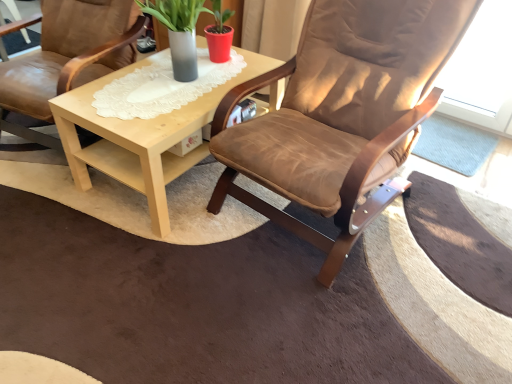
In order to click on brown leather chair at center, marked as the first chair in a left-to-right arrangement in this screenshot , I will do `click(66, 58)`.

I want to click on light wood/texture coffee table at center, so click(141, 137).

This screenshot has width=512, height=384. Find the location of `brown leather chair at center, acting as the second chair starting from the right`. brown leather chair at center, acting as the second chair starting from the right is located at coordinates (66, 58).

Is brown leather chair at center, marked as the first chair in a left-to-right arrangement, at the left side of matte gray vase at center?

Yes, brown leather chair at center, marked as the first chair in a left-to-right arrangement, is to the left of matte gray vase at center.

Which object is closer to the camera, brown leather chair at center, acting as the second chair starting from the right, or matte gray vase at center?

brown leather chair at center, acting as the second chair starting from the right, is more forward.

Is brown leather chair at center, acting as the second chair starting from the right, looking in the opposite direction of matte gray vase at center?

No, brown leather chair at center, acting as the second chair starting from the right, is not facing away from matte gray vase at center.

Is brown leather chair at center, marked as the first chair in a left-to-right arrangement, with matte gray vase at center?

brown leather chair at center, marked as the first chair in a left-to-right arrangement, and matte gray vase at center are clearly separated.

Can you confirm if matte gray vase at center is shorter than brown suede chair at center, which appears as the first chair when viewed from the right?

Yes.

Based on their positions, is matte gray vase at center located to the left or right of brown suede chair at center, the second chair when ordered from left to right?

From the image, it's evident that matte gray vase at center is to the left of brown suede chair at center, the second chair when ordered from left to right.

Could you measure the distance between matte gray vase at center and brown suede chair at center, which appears as the first chair when viewed from the right?

23.62 inches.

Considering the points (180, 38) and (272, 154), which point is behind, point (180, 38) or point (272, 154)?

Positioned behind is point (180, 38).

Which is correct: matte gray vase at center is inside brown leather chair at center, marked as the first chair in a left-to-right arrangement, or outside of it?

matte gray vase at center exists outside the volume of brown leather chair at center, marked as the first chair in a left-to-right arrangement.

From the image's perspective, which is above, matte gray vase at center or brown leather chair at center, marked as the first chair in a left-to-right arrangement?

brown leather chair at center, marked as the first chair in a left-to-right arrangement.

There is a brown leather chair at center, acting as the second chair starting from the right. Where is `houseplant above it (from a real-world perspective)`? Image resolution: width=512 pixels, height=384 pixels. houseplant above it (from a real-world perspective) is located at coordinates (179, 32).

Who is smaller, matte gray vase at center or brown leather chair at center, acting as the second chair starting from the right?

Smaller between the two is matte gray vase at center.

Is brown leather chair at center, marked as the first chair in a left-to-right arrangement, looking in the opposite direction of brown suede chair at center, the second chair when ordered from left to right?

No.

Can you see brown leather chair at center, marked as the first chair in a left-to-right arrangement, touching brown suede chair at center, the second chair when ordered from left to right?

No.

Could brown suede chair at center, which appears as the first chair when viewed from the right, be considered to be inside brown leather chair at center, acting as the second chair starting from the right?

No.

I want to click on chair that is under the brown suede chair at center, the second chair when ordered from left to right (from a real-world perspective), so click(x=66, y=58).

Is light wood/texture coffee table at center outside of brown leather chair at center, marked as the first chair in a left-to-right arrangement?

Yes, light wood/texture coffee table at center is not within brown leather chair at center, marked as the first chair in a left-to-right arrangement.

Could you measure the distance between light wood/texture coffee table at center and brown leather chair at center, acting as the second chair starting from the right?

A distance of 14.78 inches exists between light wood/texture coffee table at center and brown leather chair at center, acting as the second chair starting from the right.

Does light wood/texture coffee table at center lie behind brown leather chair at center, acting as the second chair starting from the right?

Yes.

Locate an element on the screen. Image resolution: width=512 pixels, height=384 pixels. coffee table located below the brown leather chair at center, acting as the second chair starting from the right (from the image's perspective) is located at coordinates (141, 137).

Is light wood/texture coffee table at center shorter than brown suede chair at center, the second chair when ordered from left to right?

Yes, light wood/texture coffee table at center is shorter than brown suede chair at center, the second chair when ordered from left to right.

Could you tell me if light wood/texture coffee table at center is facing brown suede chair at center, which appears as the first chair when viewed from the right?

No.

Is light wood/texture coffee table at center bigger or smaller than brown suede chair at center, the second chair when ordered from left to right?

light wood/texture coffee table at center is smaller than brown suede chair at center, the second chair when ordered from left to right.

In the image, is light wood/texture coffee table at center positioned in front of or behind matte gray vase at center?

Visually, light wood/texture coffee table at center is located in front of matte gray vase at center.

Is light wood/texture coffee table at center looking in the opposite direction of matte gray vase at center?

No, light wood/texture coffee table at center is not facing the opposite direction of matte gray vase at center.

Considering the relative sizes of light wood/texture coffee table at center and matte gray vase at center in the image provided, is light wood/texture coffee table at center shorter than matte gray vase at center?

Incorrect, the height of light wood/texture coffee table at center does not fall short of that of matte gray vase at center.

Where is `the 1st chair in front of the matte gray vase at center`? the 1st chair in front of the matte gray vase at center is located at coordinates (66, 58).

Identify the location of chair that is the 1st one below the matte gray vase at center (from a real-world perspective). (340, 113).

Based on the photo, considering their positions, is light wood/texture coffee table at center positioned closer to brown suede chair at center, the second chair when ordered from left to right, than brown leather chair at center, acting as the second chair starting from the right?

light wood/texture coffee table at center.

Estimate the real-world distances between objects in this image. Which object is further from matte gray vase at center, light wood/texture coffee table at center or brown suede chair at center, which appears as the first chair when viewed from the right?

brown suede chair at center, which appears as the first chair when viewed from the right, lies further to matte gray vase at center than the other object.

Estimate the real-world distances between objects in this image. Which object is closer to light wood/texture coffee table at center, brown leather chair at center, acting as the second chair starting from the right, or matte gray vase at center?

Among the two, matte gray vase at center is located nearer to light wood/texture coffee table at center.

Considering their positions, is brown suede chair at center, which appears as the first chair when viewed from the right, positioned closer to light wood/texture coffee table at center than brown leather chair at center, marked as the first chair in a left-to-right arrangement?

The object closer to light wood/texture coffee table at center is brown leather chair at center, marked as the first chair in a left-to-right arrangement.

From the image, which object appears to be farther from light wood/texture coffee table at center, matte gray vase at center or brown leather chair at center, acting as the second chair starting from the right?

The object further to light wood/texture coffee table at center is brown leather chair at center, acting as the second chair starting from the right.

Which object lies further to the anchor point matte gray vase at center, brown suede chair at center, the second chair when ordered from left to right, or brown leather chair at center, marked as the first chair in a left-to-right arrangement?

brown suede chair at center, the second chair when ordered from left to right, lies further to matte gray vase at center than the other object.

From the image, which object appears to be farther from brown suede chair at center, the second chair when ordered from left to right, brown leather chair at center, marked as the first chair in a left-to-right arrangement, or matte gray vase at center?

The object further to brown suede chair at center, the second chair when ordered from left to right, is brown leather chair at center, marked as the first chair in a left-to-right arrangement.

Looking at the image, which one is located further to matte gray vase at center, brown leather chair at center, acting as the second chair starting from the right, or brown suede chair at center, the second chair when ordered from left to right?

brown suede chair at center, the second chair when ordered from left to right, lies further to matte gray vase at center than the other object.

Identify the location of coffee table between brown leather chair at center, acting as the second chair starting from the right, and brown suede chair at center, which appears as the first chair when viewed from the right, from left to right. The image size is (512, 384). (141, 137).

Find the location of a particular element. The image size is (512, 384). coffee table between brown leather chair at center, acting as the second chair starting from the right, and matte gray vase at center, in the horizontal direction is located at coordinates (141, 137).

Locate an element on the screen. Image resolution: width=512 pixels, height=384 pixels. houseplant between light wood/texture coffee table at center and brown suede chair at center, which appears as the first chair when viewed from the right is located at coordinates (179, 32).

Where is `houseplant between brown leather chair at center, marked as the first chair in a left-to-right arrangement, and brown suede chair at center, which appears as the first chair when viewed from the right, in the horizontal direction`? The width and height of the screenshot is (512, 384). houseplant between brown leather chair at center, marked as the first chair in a left-to-right arrangement, and brown suede chair at center, which appears as the first chair when viewed from the right, in the horizontal direction is located at coordinates (179, 32).